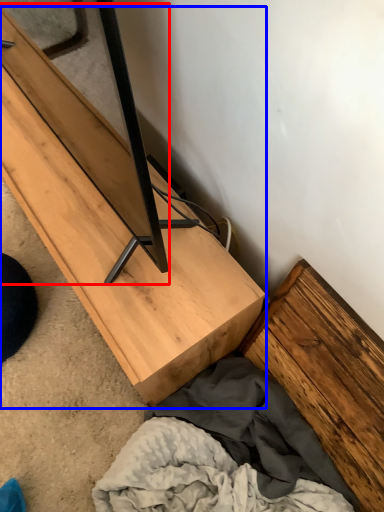
Question: Which of the following is the closest to the observer, plank (highlighted by a red box) or furniture (highlighted by a blue box)?

Choices:
 (A) plank
 (B) furniture

Answer: (A)